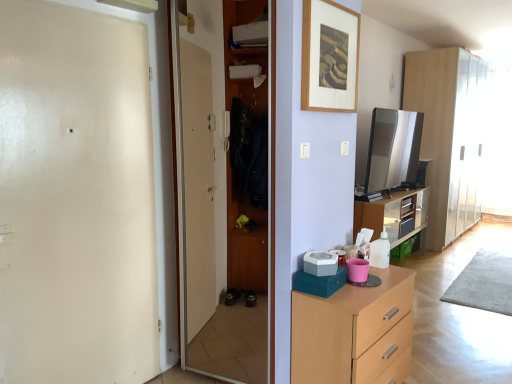
Question: Is wooden picture frame at upper center a part of light wood chest of drawers at lower right?

Choices:
 (A) yes
 (B) no

Answer: (B)

Question: Is light wood chest of drawers at lower right further to the viewer compared to wooden picture frame at upper center?

Choices:
 (A) yes
 (B) no

Answer: (B)

Question: Is light wood chest of drawers at lower right at the right side of wooden picture frame at upper center?

Choices:
 (A) yes
 (B) no

Answer: (A)

Question: Is light wood chest of drawers at lower right looking in the opposite direction of wooden picture frame at upper center?

Choices:
 (A) yes
 (B) no

Answer: (B)

Question: Can you confirm if light wood chest of drawers at lower right is positioned to the left of wooden picture frame at upper center?

Choices:
 (A) yes
 (B) no

Answer: (B)

Question: From their relative heights in the image, would you say white glossy door at left, the 2th screen door positioned from the right, is taller or shorter than wooden picture frame at upper center?

Choices:
 (A) tall
 (B) short

Answer: (A)

Question: Is white glossy door at left, the 2th screen door positioned from the right, inside the boundaries of wooden picture frame at upper center, or outside?

Choices:
 (A) inside
 (B) outside

Answer: (B)

Question: Considering the positions of white glossy door at left, which is counted as the 1th screen door, starting from the left, and wooden picture frame at upper center in the image, is white glossy door at left, which is counted as the 1th screen door, starting from the left, wider or thinner than wooden picture frame at upper center?

Choices:
 (A) thin
 (B) wide

Answer: (B)

Question: In terms of size, does white glossy door at left, which is counted as the 1th screen door, starting from the left, appear bigger or smaller than wooden picture frame at upper center?

Choices:
 (A) big
 (B) small

Answer: (A)

Question: From a real-world perspective, is satin silver tv at upper right, marked as the 2th appliance in a left-to-right arrangement, positioned above or below wooden wardrobe at center, acting as the 2th screen door starting from the left?

Choices:
 (A) below
 (B) above

Answer: (B)

Question: Considering the positions of satin silver tv at upper right, arranged as the second appliance when viewed from the front, and wooden wardrobe at center, acting as the 2th screen door starting from the left, in the image, is satin silver tv at upper right, arranged as the second appliance when viewed from the front, bigger or smaller than wooden wardrobe at center, acting as the 2th screen door starting from the left,?

Choices:
 (A) small
 (B) big

Answer: (B)

Question: From the image's perspective, is satin silver tv at upper right, arranged as the second appliance when viewed from the front, above or below wooden wardrobe at center, acting as the 2th screen door starting from the left?

Choices:
 (A) above
 (B) below

Answer: (A)

Question: Which is correct: satin silver tv at upper right, marked as the 2th appliance in a left-to-right arrangement, is inside wooden wardrobe at center, which is counted as the first screen door, starting from the right, or outside of it?

Choices:
 (A) inside
 (B) outside

Answer: (B)

Question: Is point (74, 91) closer or farther from the camera than point (404, 342)?

Choices:
 (A) farther
 (B) closer

Answer: (B)

Question: Is white glossy door at left, which is counted as the 1th screen door, starting from the left, taller or shorter than light wood chest of drawers at lower right?

Choices:
 (A) tall
 (B) short

Answer: (A)